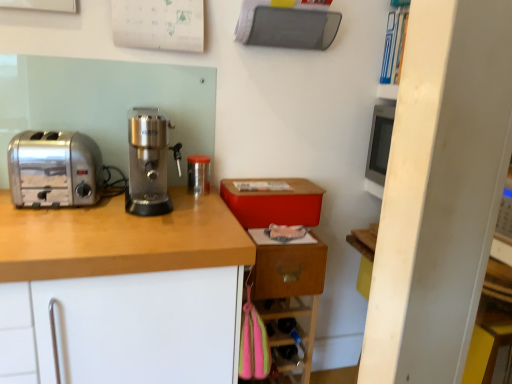
At what (x,y) coordinates should I click in order to perform the action: click on free space above wooden drawer at lower right (from a real-world perspective). Please return your answer as a coordinate pair (x, y). This screenshot has width=512, height=384. Looking at the image, I should click on (283, 231).